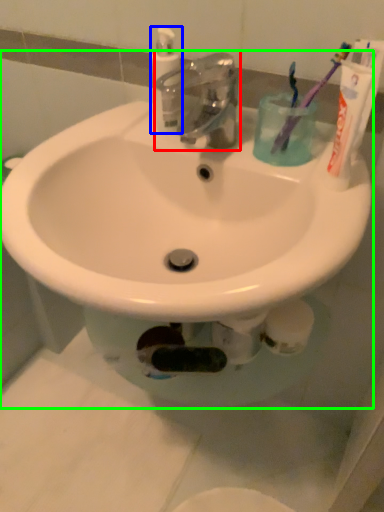
Question: Which is nearer to the tap (highlighted by a red box)? cleaning product (highlighted by a blue box) or sink (highlighted by a green box).

Choices:
 (A) cleaning product
 (B) sink

Answer: (A)